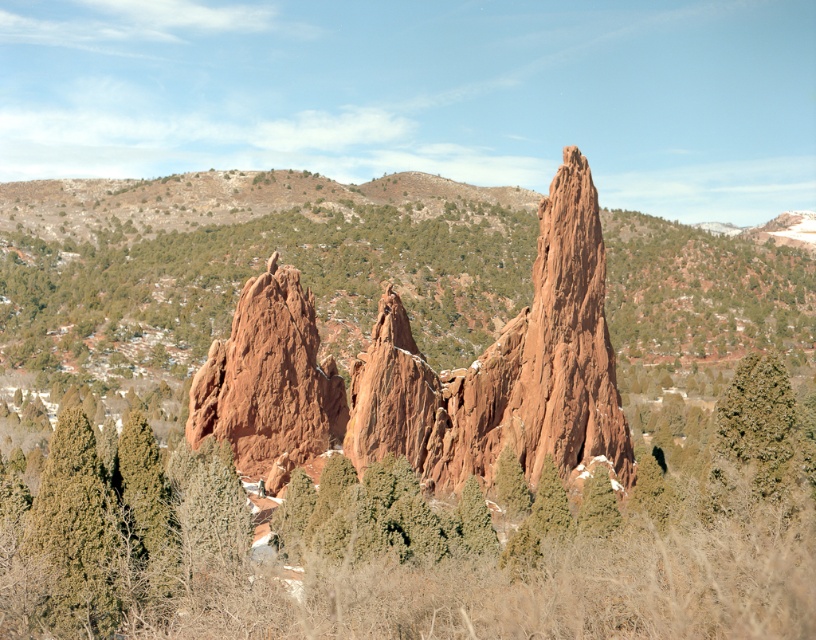
Does rustic sandstone rock formation at center have a greater width compared to green textured pine at center?

Yes.

Describe the element at coordinates (429, 372) in the screenshot. I see `rustic sandstone rock formation at center` at that location.

Identify the location of rustic sandstone rock formation at center. (429, 372).

You are a GUI agent. You are given a task and a screenshot of the screen. Output one action in this format:
    pyautogui.click(x=<x>, y=<y>)
    Task: Click on the rustic sandstone rock formation at center
    The height and width of the screenshot is (640, 816).
    Given the screenshot: What is the action you would take?
    pyautogui.click(x=429, y=372)